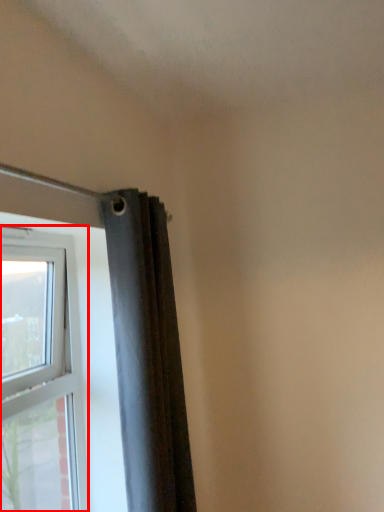
Question: Observing the image, what is the correct spatial positioning of window (annotated by the red box) in reference to curtain?

Choices:
 (A) right
 (B) left

Answer: (B)